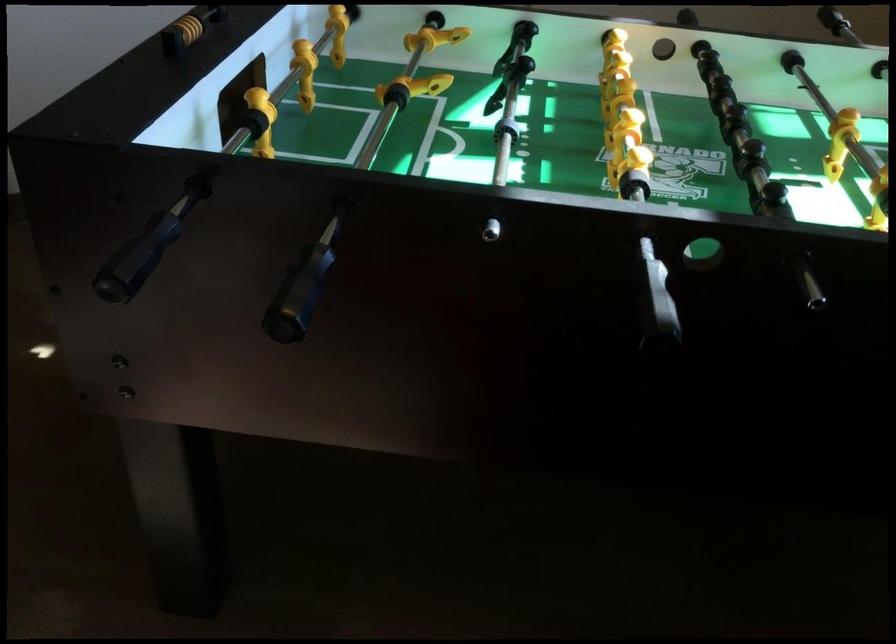
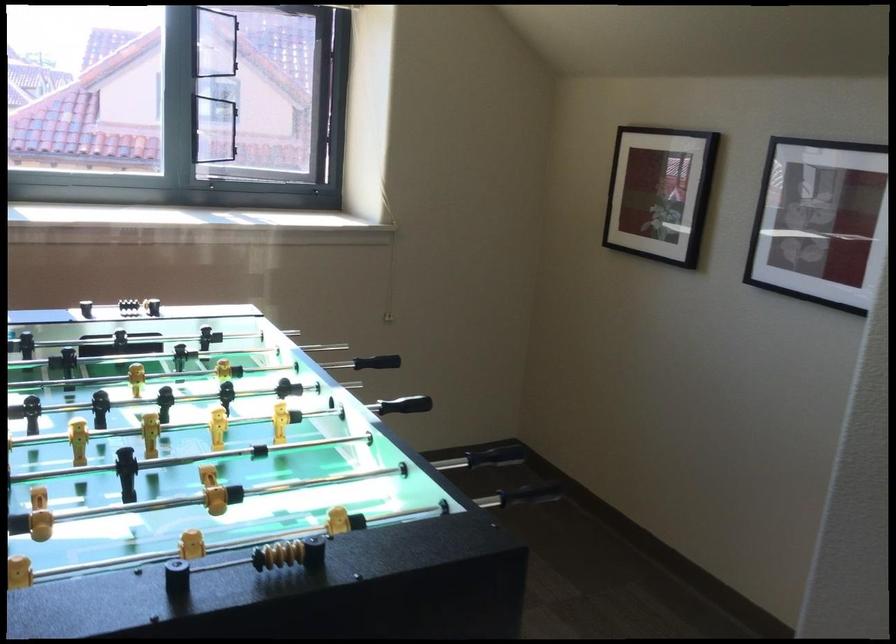
In the second image, find the point that corresponds to point 192,263 in the first image.

(531, 493)